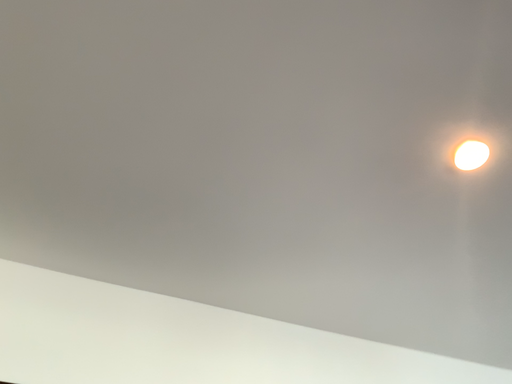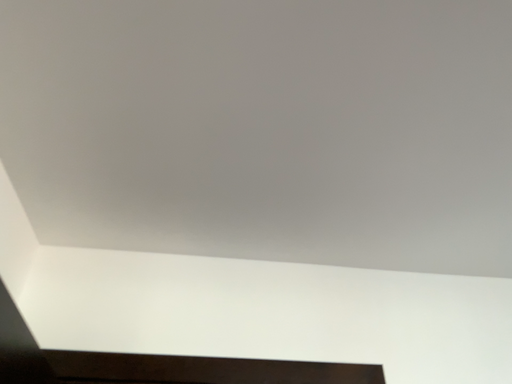
Question: Which way did the camera rotate in the video?

Choices:
 (A) rotated downward
 (B) rotated upward

Answer: (A)